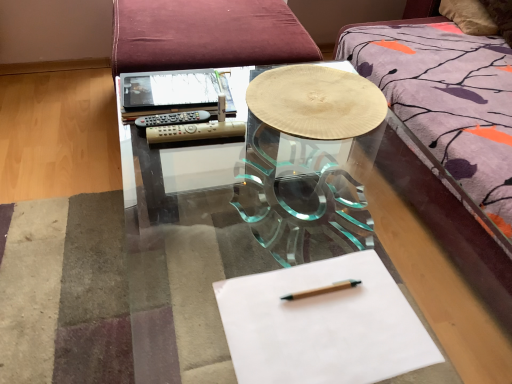
Question: Is white paper at center completely or partially outside of wooden textured plate at center?

Choices:
 (A) no
 (B) yes

Answer: (B)

Question: Can you confirm if white paper at center is smaller than wooden textured plate at center?

Choices:
 (A) no
 (B) yes

Answer: (B)

Question: Is white paper at center not close to wooden textured plate at center?

Choices:
 (A) no
 (B) yes

Answer: (A)

Question: Is white paper at center facing towards wooden textured plate at center?

Choices:
 (A) yes
 (B) no

Answer: (B)

Question: From a real-world perspective, is white paper at center over wooden textured plate at center?

Choices:
 (A) yes
 (B) no

Answer: (B)

Question: Considering their positions, is white paper at center located in front of or behind wooden pencil at center?

Choices:
 (A) front
 (B) behind

Answer: (A)

Question: From a real-world perspective, is white paper at center above or below wooden pencil at center?

Choices:
 (A) above
 (B) below

Answer: (B)

Question: Looking at their shapes, would you say white paper at center is wider or thinner than wooden pencil at center?

Choices:
 (A) wide
 (B) thin

Answer: (A)

Question: Does point (395, 301) appear closer or farther from the camera than point (342, 289)?

Choices:
 (A) closer
 (B) farther

Answer: (A)

Question: Is matte black notebook at upper left spatially inside wooden pencil at center, or outside of it?

Choices:
 (A) inside
 (B) outside

Answer: (B)

Question: Looking at their shapes, would you say matte black notebook at upper left is wider or thinner than wooden pencil at center?

Choices:
 (A) wide
 (B) thin

Answer: (A)

Question: From a real-world perspective, is matte black notebook at upper left positioned above or below wooden pencil at center?

Choices:
 (A) below
 (B) above

Answer: (B)

Question: Is point (137, 92) positioned closer to the camera than point (281, 299)?

Choices:
 (A) farther
 (B) closer

Answer: (A)

Question: From a real-world perspective, is wooden textured plate at center above or below wooden pencil at center?

Choices:
 (A) above
 (B) below

Answer: (A)

Question: Is wooden textured plate at center situated inside wooden pencil at center or outside?

Choices:
 (A) outside
 (B) inside

Answer: (A)